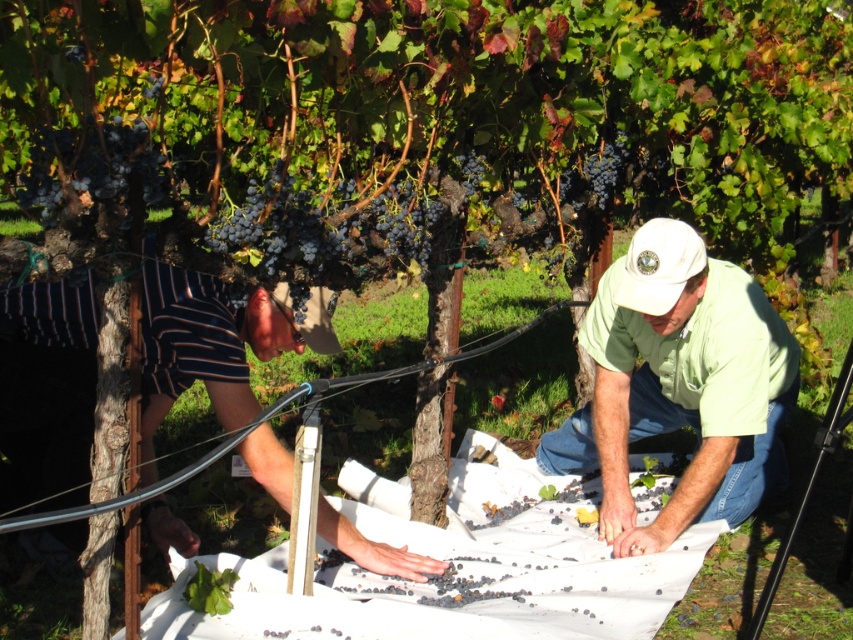
Is ripe dark purple grapes at upper left closer to camera compared to shiny purple grape at center?

That is True.

Who is lower down, ripe dark purple grapes at upper left or shiny purple grape at center?

ripe dark purple grapes at upper left is lower down.

Does point (32, 182) come behind point (155, 76)?

No, it is in front of (155, 76).

Identify the location of ripe dark purple grapes at upper left. The image size is (853, 640). (90, 170).

Does dark purple grapes at upper center have a lesser width compared to shiny purple grape at center?

In fact, dark purple grapes at upper center might be wider than shiny purple grape at center.

Is point (596, 196) positioned behind point (148, 88)?

Yes.

This screenshot has height=640, width=853. Identify the location of dark purple grapes at upper center. (605, 168).

Does point (300, 330) lie in front of point (584, 166)?

Yes, it is.

The image size is (853, 640). In order to click on striped cotton shorts at lower left in this screenshot , I will do `click(215, 342)`.

This screenshot has height=640, width=853. What do you see at coordinates (215, 342) in the screenshot? I see `striped cotton shorts at lower left` at bounding box center [215, 342].

Find the location of `striped cotton shorts at lower left`. striped cotton shorts at lower left is located at coordinates (215, 342).